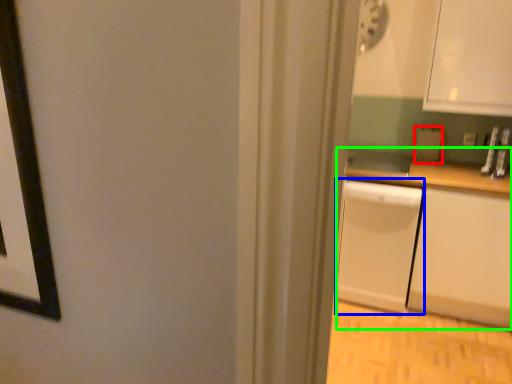
Question: Which object is positioned farthest from appliance (highlighted by a red box)? Select from dish washer (highlighted by a blue box) and counter (highlighted by a green box).

Choices:
 (A) dish washer
 (B) counter

Answer: (A)